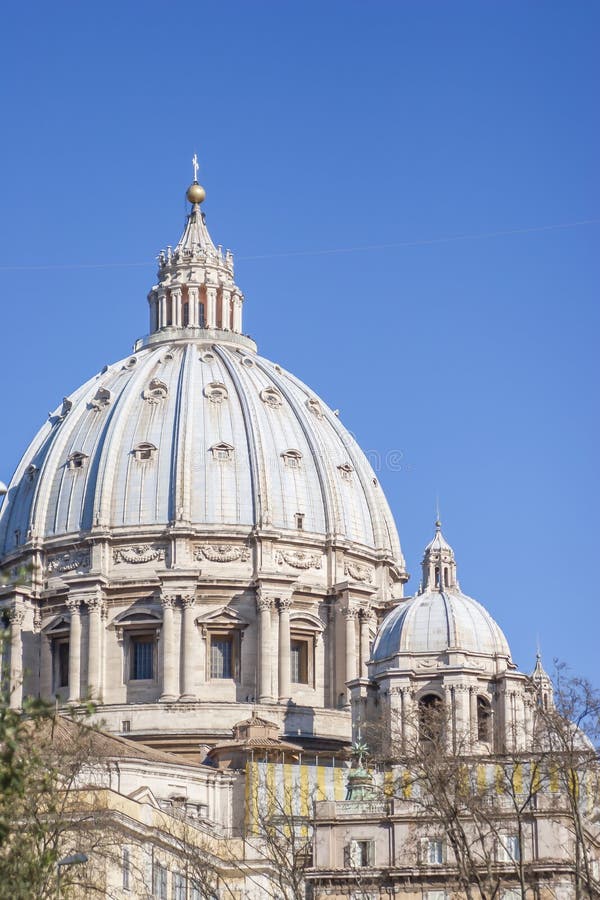
Find the location of a particular element. The width and height of the screenshot is (600, 900). wall is located at coordinates (186, 721).